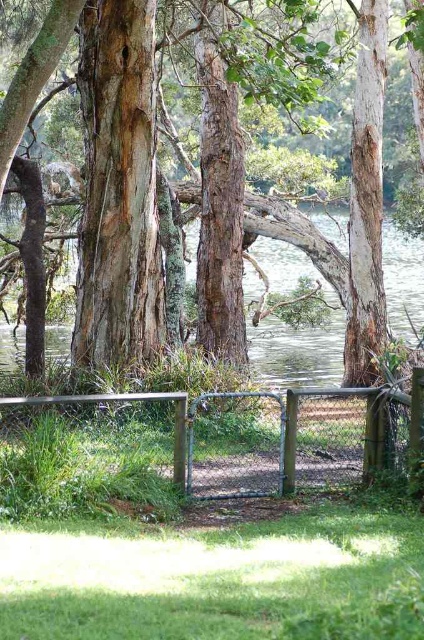
Is point (376, 116) farther from camera compared to point (21, 355)?

That is False.

In the scene shown: Is rough bark tree at center bigger than clear water at center?

Actually, rough bark tree at center might be smaller than clear water at center.

Which is behind, point (360, 314) or point (295, 268)?

Point (295, 268)

The height and width of the screenshot is (640, 424). Find the location of `rough bark tree at center`. rough bark tree at center is located at coordinates point(349,212).

Which is more to the left, clear water at center or metallic silver bench at lower center?

metallic silver bench at lower center

Is the position of clear water at center less distant than that of metallic silver bench at lower center?

No, it is not.

Does point (412, 321) lie behind point (141, 392)?

Yes, it is behind point (141, 392).

The image size is (424, 640). Find the location of `clear water at center`. clear water at center is located at coordinates (295, 330).

Who is lower down, rough bark tree at center or metallic silver bench at lower center?

metallic silver bench at lower center is below.

Is point (376, 77) closer to viewer compared to point (13, 404)?

No, (376, 77) is further to viewer.

Find the location of `rough bark tree at center`. rough bark tree at center is located at coordinates (349, 212).